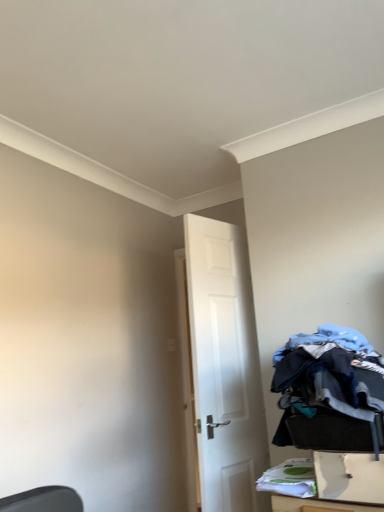
Question: Considering the relative sizes of white matte door at center and denim fabric laundry at lower right in the image provided, is white matte door at center smaller than denim fabric laundry at lower right?

Choices:
 (A) yes
 (B) no

Answer: (B)

Question: Would you say white matte door at center is a long distance from denim fabric laundry at lower right?

Choices:
 (A) yes
 (B) no

Answer: (B)

Question: Considering the relative sizes of white matte door at center and denim fabric laundry at lower right in the image provided, is white matte door at center wider than denim fabric laundry at lower right?

Choices:
 (A) yes
 (B) no

Answer: (B)

Question: Considering the relative positions of white matte door at center and denim fabric laundry at lower right in the image provided, is white matte door at center to the left of denim fabric laundry at lower right from the viewer's perspective?

Choices:
 (A) yes
 (B) no

Answer: (A)

Question: Is white matte door at center oriented towards denim fabric laundry at lower right?

Choices:
 (A) yes
 (B) no

Answer: (B)

Question: Is point (306, 368) positioned closer to the camera than point (241, 500)?

Choices:
 (A) closer
 (B) farther

Answer: (A)

Question: From the image's perspective, is denim fabric laundry at lower right above or below white matte door at center?

Choices:
 (A) above
 (B) below

Answer: (A)

Question: Relative to white matte door at center, is denim fabric laundry at lower right in front or behind?

Choices:
 (A) behind
 (B) front

Answer: (B)

Question: Visually, is denim fabric laundry at lower right positioned to the left or to the right of white matte door at center?

Choices:
 (A) left
 (B) right

Answer: (B)

Question: Looking at their shapes, would you say white matte door at center is wider or thinner than white plastic drawer at lower right?

Choices:
 (A) thin
 (B) wide

Answer: (A)

Question: In the image, is white matte door at center positioned in front of or behind white plastic drawer at lower right?

Choices:
 (A) front
 (B) behind

Answer: (B)

Question: Considering the positions of white matte door at center and white plastic drawer at lower right in the image, is white matte door at center bigger or smaller than white plastic drawer at lower right?

Choices:
 (A) small
 (B) big

Answer: (B)

Question: Would you say white matte door at center is to the left or to the right of white plastic drawer at lower right in the picture?

Choices:
 (A) right
 (B) left

Answer: (B)

Question: Is white plastic drawer at lower right in front of or behind white matte door at center in the image?

Choices:
 (A) behind
 (B) front

Answer: (B)

Question: From the image's perspective, is white plastic drawer at lower right above or below white matte door at center?

Choices:
 (A) below
 (B) above

Answer: (A)